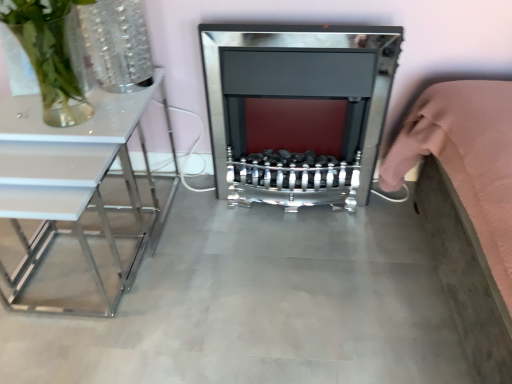
Question: Is point (34, 135) closer or farther from the camera than point (497, 84)?

Choices:
 (A) closer
 (B) farther

Answer: (B)

Question: Considering the relative positions of white glossy table at left and pink fabric bed at right in the image provided, is white glossy table at left to the left or to the right of pink fabric bed at right?

Choices:
 (A) right
 (B) left

Answer: (B)

Question: Which is farther from the clear glass vase at upper left?

Choices:
 (A) white glossy table at left
 (B) polished chrome fireplace at center
 (C) pink fabric bed at right
 (D) concretesmoothfloor at center

Answer: (C)

Question: Estimate the real-world distances between objects in this image. Which object is closer to the pink fabric bed at right?

Choices:
 (A) clear glass vase at upper left
 (B) polished chrome fireplace at center
 (C) concretesmoothfloor at center
 (D) white glossy table at left

Answer: (B)